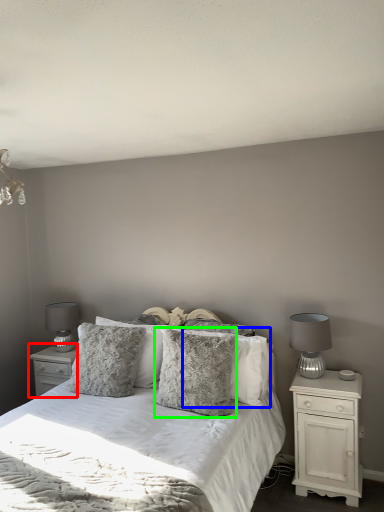
Question: Which object is the closest to the nightstand (highlighted by a red box)? Choose among these: pillow (highlighted by a blue box) or pillow (highlighted by a green box).

Choices:
 (A) pillow
 (B) pillow

Answer: (B)